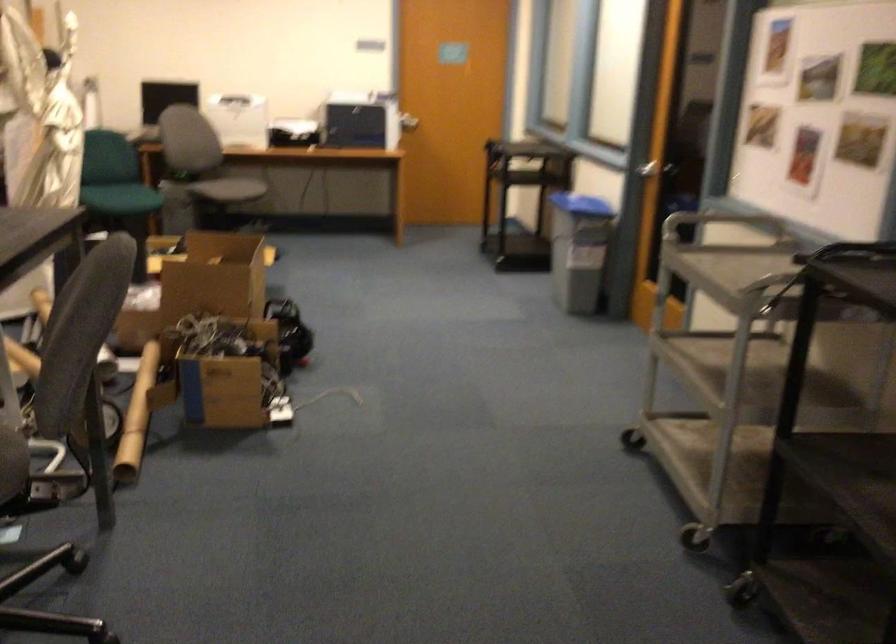
This screenshot has width=896, height=644. Describe the element at coordinates (228, 190) in the screenshot. I see `a grey chair sitting surface` at that location.